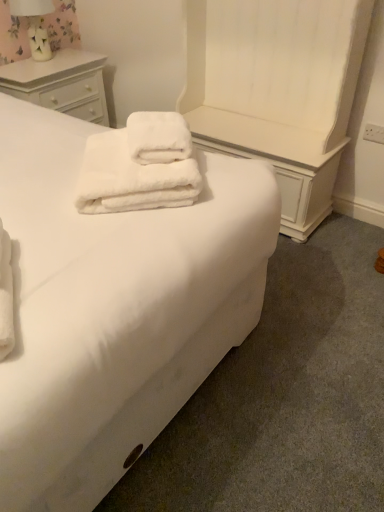
Question: Considering the relative positions of white fluffy towels at center and white soft bed at center in the image provided, is white fluffy towels at center to the left or to the right of white soft bed at center?

Choices:
 (A) left
 (B) right

Answer: (B)

Question: From a real-world perspective, relative to white soft bed at center, is white fluffy towels at center vertically above or below?

Choices:
 (A) above
 (B) below

Answer: (A)

Question: Considering the real-world distances, which object is farthest from the white soft bed at center?

Choices:
 (A) white fluffy towels at center
 (B) white wood chest of drawers at upper left
 (C) floral fabric lampshade at upper left

Answer: (C)

Question: Estimate the real-world distances between objects in this image. Which object is closer to the white soft bed at center?

Choices:
 (A) floral fabric lampshade at upper left
 (B) white wood chest of drawers at upper left
 (C) white fluffy towels at center

Answer: (C)